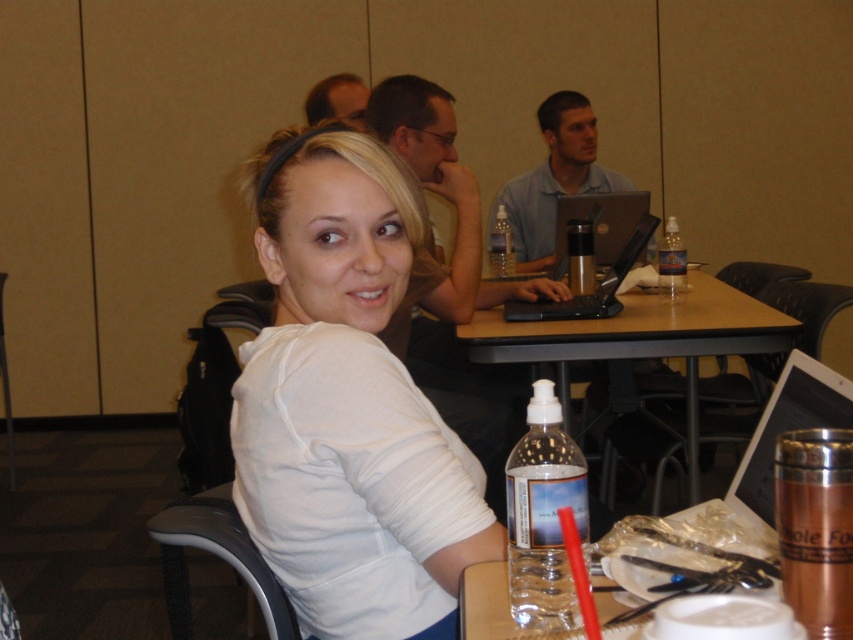
Question: Is metallic silver chair at lower right to the right of gray plastic chair at lower left from the viewer's perspective?

Choices:
 (A) no
 (B) yes

Answer: (B)

Question: Is white matte shirt at center closer to the viewer compared to metallic silver chair at lower right?

Choices:
 (A) yes
 (B) no

Answer: (A)

Question: Is metallic silver laptop at center below metallic gray chair at left?

Choices:
 (A) no
 (B) yes

Answer: (A)

Question: Estimate the real-world distances between objects in this image. Which object is farther from the white matte shirt at center?

Choices:
 (A) clear plastic bottle at center
 (B) clear plastic bottle at table right
 (C) silver metallic laptop at center

Answer: (A)

Question: Considering the real-world distances, which object is closest to the silver metallic laptop at center?

Choices:
 (A) brown wooden table at center
 (B) white matte shirt at center
 (C) metallic silver thermos at center
 (D) gray plastic chair at lower left

Answer: (B)

Question: Estimate the real-world distances between objects in this image. Which object is closer to the brown wooden table at center?

Choices:
 (A) matte black hair at upper center
 (B) metallic silver chair at lower right

Answer: (B)